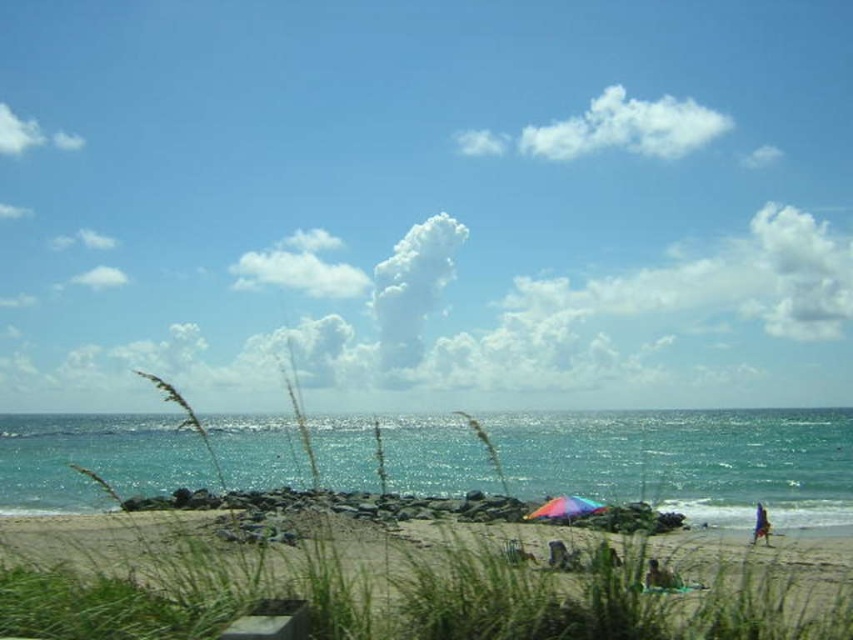
Looking at this image, can you confirm if glistening blue water at center is positioned above blue fabric umbrella at lower right?

Actually, glistening blue water at center is below blue fabric umbrella at lower right.

Is point (103, 436) behind point (766, 518)?

Yes, point (103, 436) is behind point (766, 518).

This screenshot has height=640, width=853. Identify the location of glistening blue water at center. (688, 460).

Where is `beige sandy beach at lower center`? The height and width of the screenshot is (640, 853). beige sandy beach at lower center is located at coordinates (461, 579).

Does beige sandy beach at lower center appear on the left side of brown textured fabric at lower right?

Yes, beige sandy beach at lower center is to the left of brown textured fabric at lower right.

Where is `beige sandy beach at lower center`? The height and width of the screenshot is (640, 853). beige sandy beach at lower center is located at coordinates (461, 579).

Consider the image. Does beige sandy beach at lower center have a lesser height compared to glistening blue water at center?

Correct, beige sandy beach at lower center is not as tall as glistening blue water at center.

Where is `beige sandy beach at lower center`? beige sandy beach at lower center is located at coordinates (461, 579).